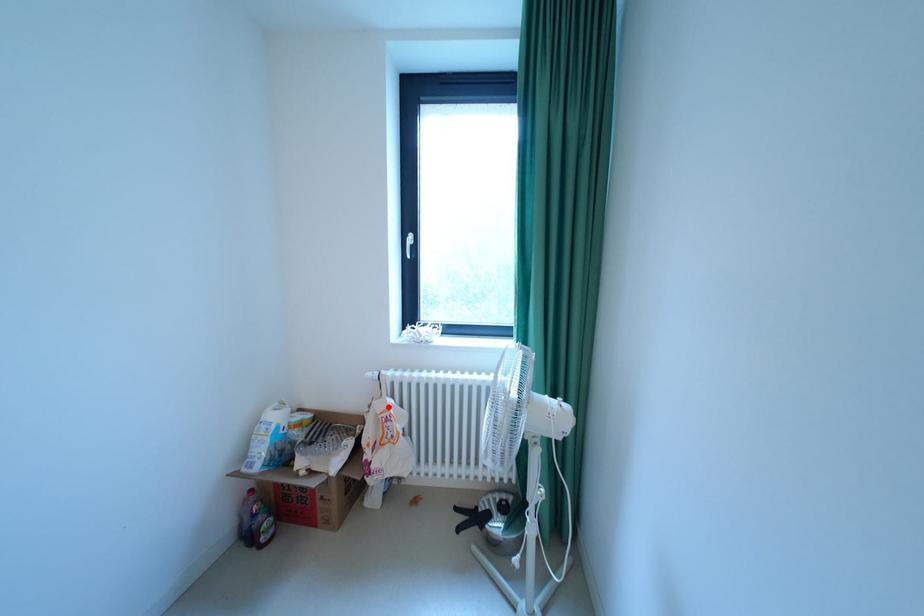
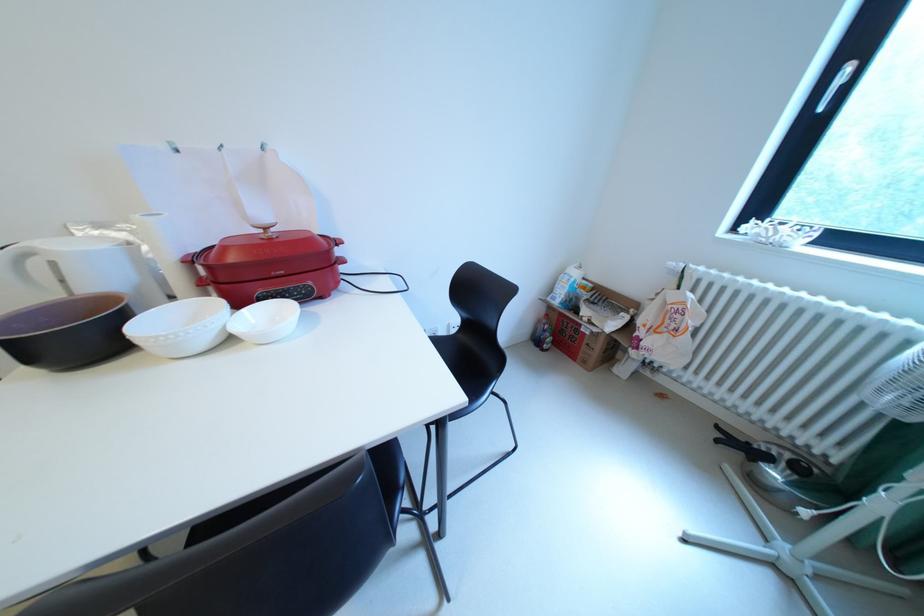
Question: I am providing you with two images of the same scene from different viewpoints. Image1 has a red point marked. In image2, the corresponding 3D location appears at what relative position? Reply with the corresponding letter.

Choices:
 (A) Closer
 (B) Farther

Answer: (A)